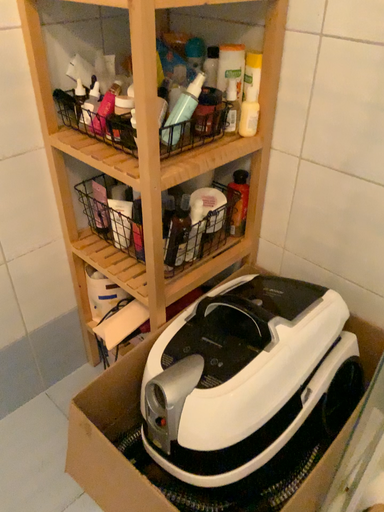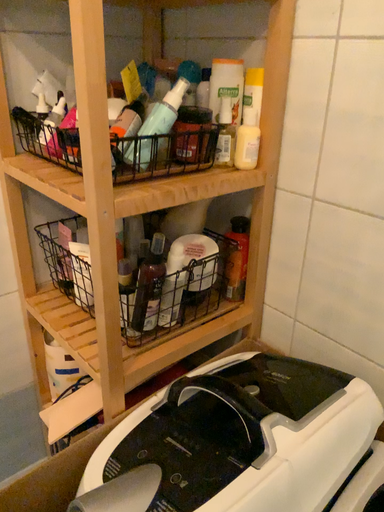
Question: Which way did the camera rotate in the video?

Choices:
 (A) rotated downward
 (B) rotated upward

Answer: (B)